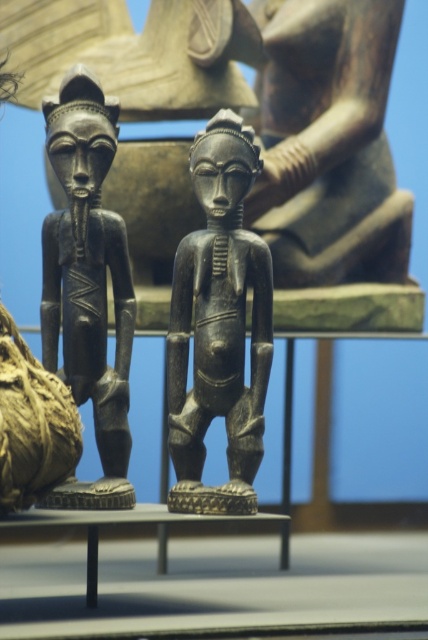
You are a museum curator planning to rearrange the African sculptures. You need to place the smooth dark wood figure at center and the black polished wood figure at center on a shelf that can only hold items up to the size of the larger one. Which sculpture should you place first to ensure they both fit?

The smooth dark wood figure at center is larger in size than the black polished wood figure at center, so you should place the smooth dark wood figure at center first to ensure both sculptures fit on the shelf.

You are a security guard in the museum and need to check the distance between the black polished wood figure at center and the black polished wood figurine at left. Can you determine which one is closer to you based on their positions?

The black polished wood figure at center is closer to you because it is positioned in front of the black polished wood figurine at left.